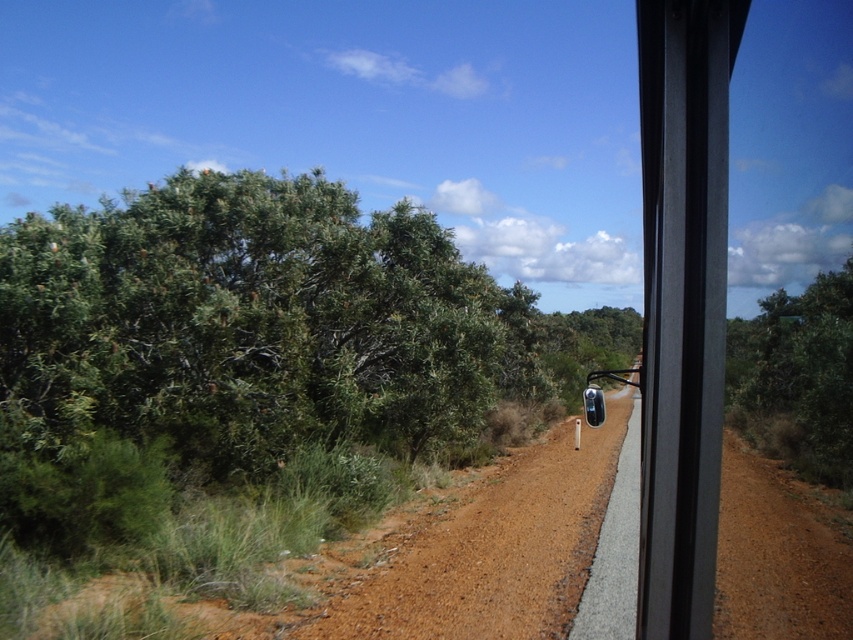
Which is below, green leafy bush at center or transparent plastic mirror at center?

transparent plastic mirror at center is lower down.

Is green leafy bush at center further to camera compared to transparent plastic mirror at center?

Yes, green leafy bush at center is further from the viewer.

Who is more distant from viewer, (834,464) or (589,579)?

Positioned behind is point (834,464).

Image resolution: width=853 pixels, height=640 pixels. What are the coordinates of `green leafy bush at center` in the screenshot? It's located at (798, 376).

Who is higher up, green leafy bush at left or green leafy bush at center?

green leafy bush at center is above.

Who is taller, green leafy bush at left or green leafy bush at center?

green leafy bush at center

At what (x,y) coordinates should I click in order to perform the action: click on green leafy bush at left. Please return your answer as a coordinate pair (x, y). This screenshot has height=640, width=853. Looking at the image, I should click on (254, 324).

Is point (532, 346) positioned after point (602, 566)?

Yes, point (532, 346) is behind point (602, 566).

Does green leafy bush at left appear over transparent plastic mirror at center?

Correct, green leafy bush at left is located above transparent plastic mirror at center.

What are the coordinates of `green leafy bush at left` in the screenshot? It's located at (254, 324).